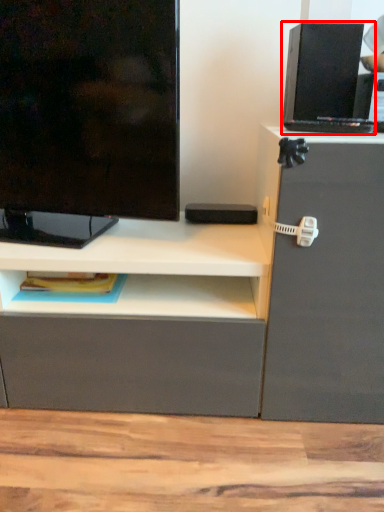
Question: From the image's perspective, what is the correct spatial relationship of computer (annotated by the red box) in relation to television?

Choices:
 (A) above
 (B) below

Answer: (A)